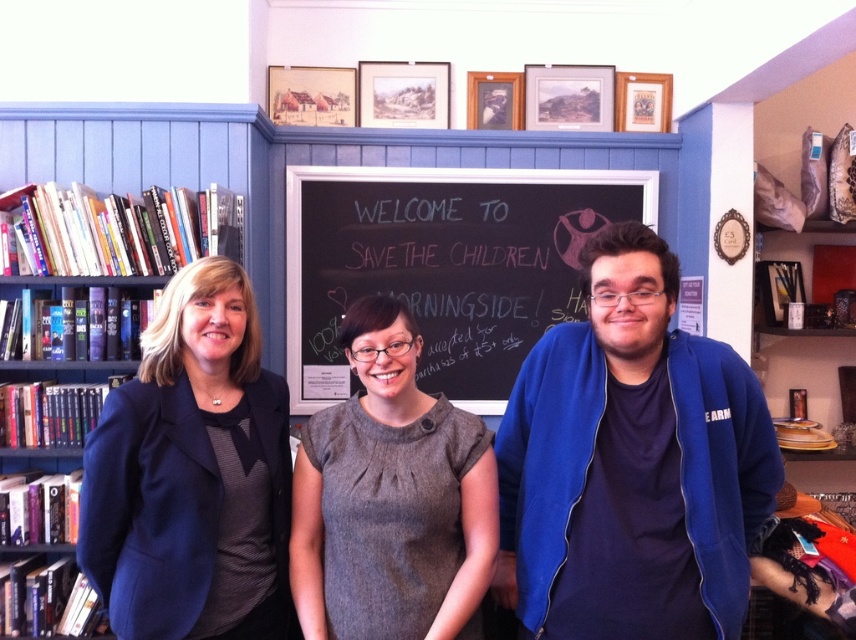
Question: Is blue fleece jacket at center to the left of gray woolen dress at center from the viewer's perspective?

Choices:
 (A) no
 (B) yes

Answer: (A)

Question: Which point is closer to the camera?

Choices:
 (A) (274, 458)
 (B) (431, 212)

Answer: (A)

Question: Which point appears farthest from the camera in this image?

Choices:
 (A) (514, 531)
 (B) (82, 486)

Answer: (A)

Question: Can you confirm if blue fleece jacket at center is positioned to the right of gray woolen dress at center?

Choices:
 (A) yes
 (B) no

Answer: (A)

Question: Can you confirm if blue fleece jacket at center is smaller than navy blue fabric jacket at left?

Choices:
 (A) yes
 (B) no

Answer: (B)

Question: Among these points, which one is nearest to the camera?

Choices:
 (A) (545, 289)
 (B) (428, 548)
 (C) (123, 419)

Answer: (C)